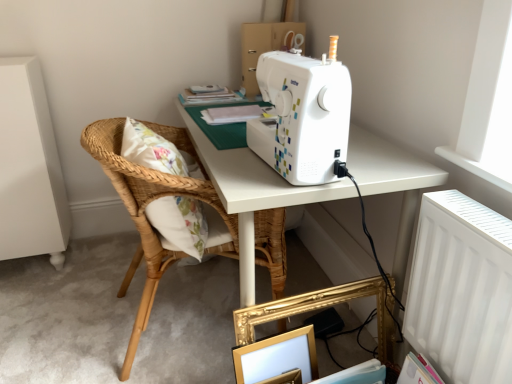
Question: Is natural woven wood pillow at left at the left side of white plastic radiator at upper right?

Choices:
 (A) yes
 (B) no

Answer: (A)

Question: From a real-world perspective, is natural woven wood pillow at left on white plastic radiator at upper right?

Choices:
 (A) yes
 (B) no

Answer: (A)

Question: Are natural woven wood pillow at left and white plastic radiator at upper right making contact?

Choices:
 (A) no
 (B) yes

Answer: (A)

Question: Can you confirm if natural woven wood pillow at left is positioned to the right of white plastic radiator at upper right?

Choices:
 (A) no
 (B) yes

Answer: (A)

Question: Is the position of natural woven wood pillow at left less distant than that of white plastic radiator at upper right?

Choices:
 (A) yes
 (B) no

Answer: (B)

Question: Would you consider natural woven wood pillow at left to be distant from white plastic radiator at upper right?

Choices:
 (A) no
 (B) yes

Answer: (A)

Question: Is white paper at upper center looking in the opposite direction of white plastic sewing machine at upper center?

Choices:
 (A) yes
 (B) no

Answer: (A)

Question: Is white paper at upper center aimed at white plastic sewing machine at upper center?

Choices:
 (A) no
 (B) yes

Answer: (B)

Question: Is white paper at upper center to the left of white plastic sewing machine at upper center from the viewer's perspective?

Choices:
 (A) yes
 (B) no

Answer: (A)

Question: From the image's perspective, is white paper at upper center beneath white plastic sewing machine at upper center?

Choices:
 (A) yes
 (B) no

Answer: (B)

Question: From the image's perspective, is white paper at upper center above white plastic sewing machine at upper center?

Choices:
 (A) yes
 (B) no

Answer: (A)

Question: Is there a large distance between white paper at upper center and white plastic sewing machine at upper center?

Choices:
 (A) no
 (B) yes

Answer: (A)

Question: Is gold metallic picture frame at lower center to the right of white plastic radiator at upper right from the viewer's perspective?

Choices:
 (A) yes
 (B) no

Answer: (B)